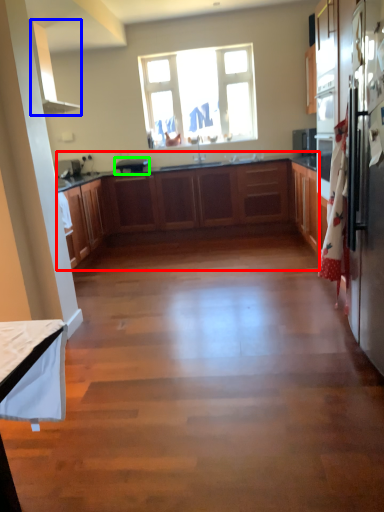
Question: Estimate the real-world distances between objects in this image. Which object is closer to cabinetry (highlighted by a red box), exhaust hood (highlighted by a blue box) or appliance (highlighted by a green box)?

Choices:
 (A) exhaust hood
 (B) appliance

Answer: (B)